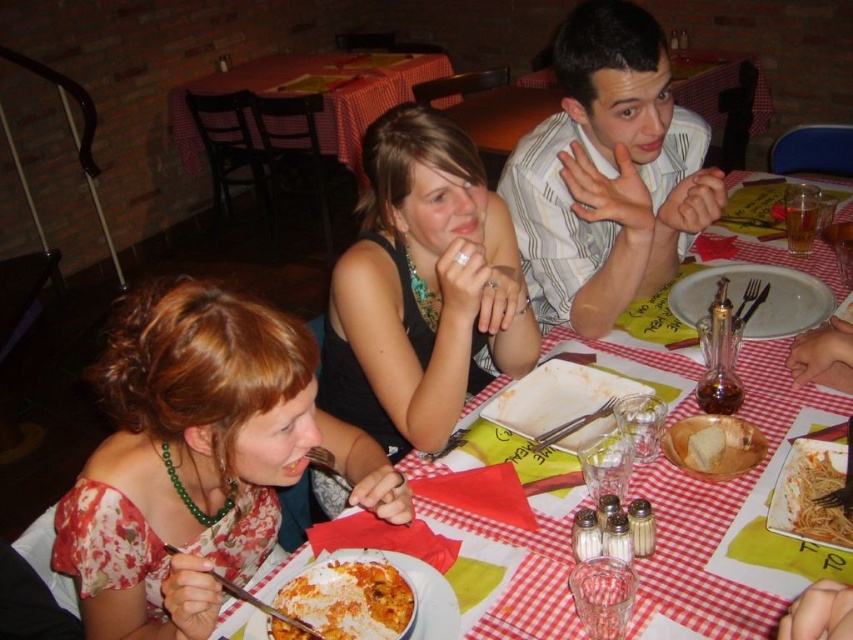
Question: Which point appears farthest from the camera in this image?

Choices:
 (A) (349, 141)
 (B) (357, 381)
 (C) (276, 317)

Answer: (A)

Question: Estimate the real-world distances between objects in this image. Which object is farther from the red checkered tablecloth at center?

Choices:
 (A) checkered fabric table at center
 (B) white porcelain plate at center
 (C) black matte dress at center
 (D) white striped shirt at center

Answer: (A)

Question: Can you confirm if floral fabric dress at center is positioned below black matte dress at center?

Choices:
 (A) yes
 (B) no

Answer: (A)

Question: Which of the following is the farthest from the observer?

Choices:
 (A) white porcelain plate at center
 (B) floral fabric dress at center

Answer: (A)

Question: Is white porcelain plate at center above white glossy pasta at center?

Choices:
 (A) no
 (B) yes

Answer: (B)

Question: Is black matte dress at center below red checkered tablecloth at center?

Choices:
 (A) yes
 (B) no

Answer: (B)